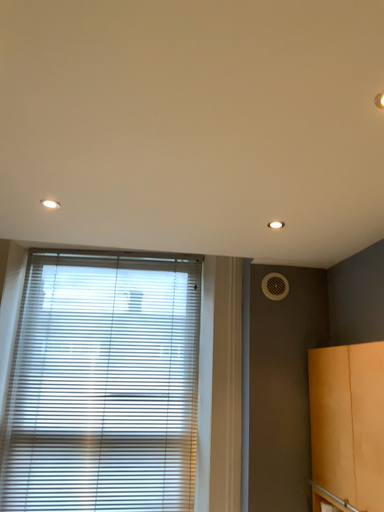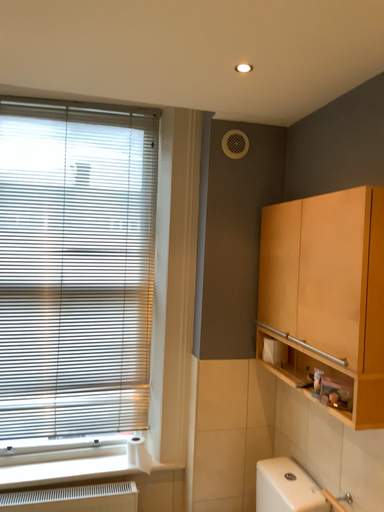
Question: Which way did the camera rotate in the video?

Choices:
 (A) rotated downward
 (B) rotated upward

Answer: (A)